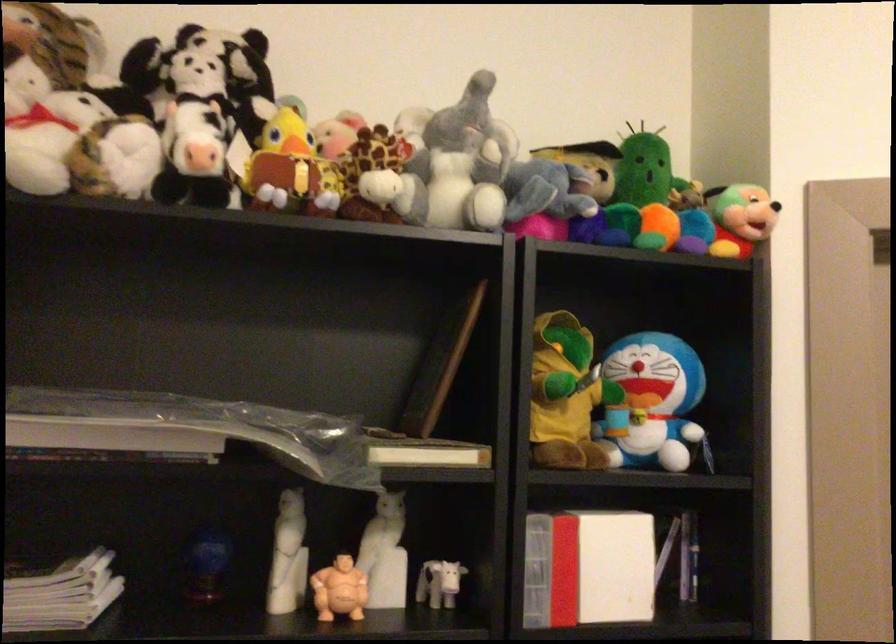
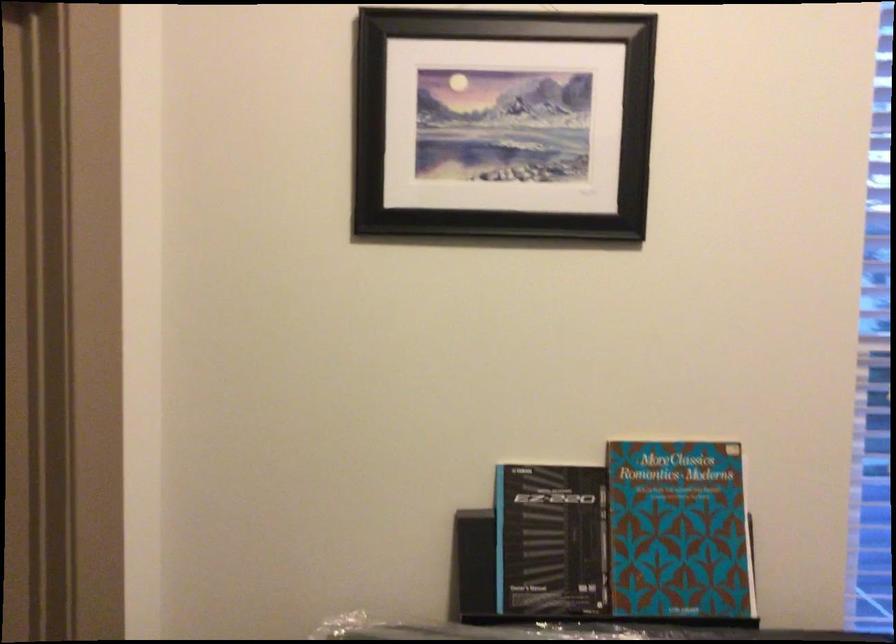
Question: Based on the continuous images, in which direction is the camera rotating? Reply with the corresponding letter.

Choices:
 (A) Left
 (B) Right
 (C) Up
 (D) Down

Answer: (B)